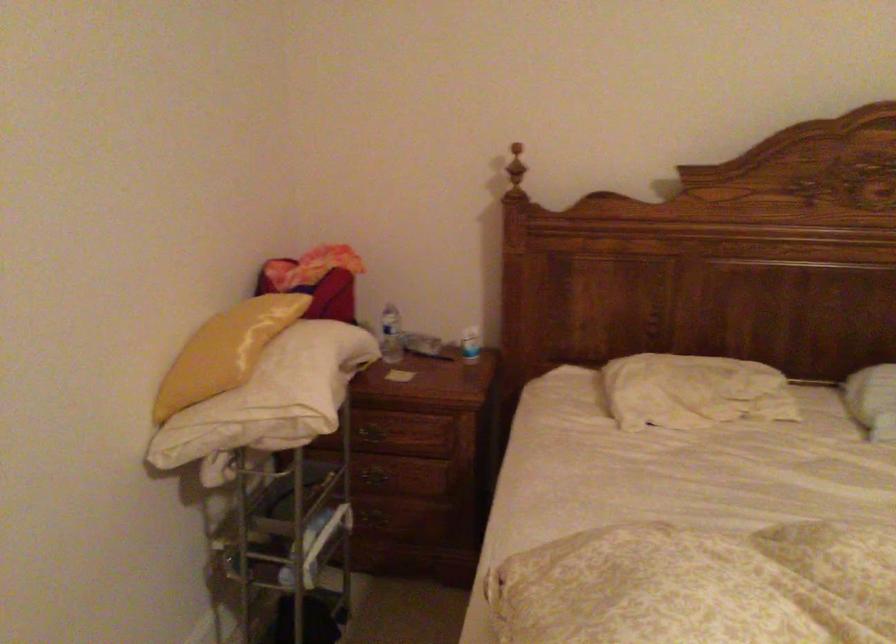
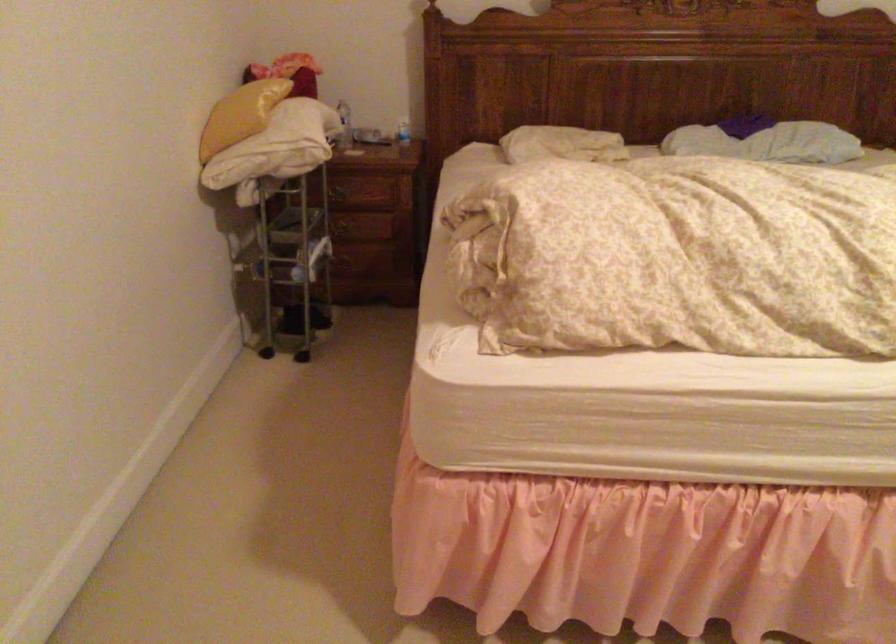
Question: I am providing you with two images of the same scene from different viewpoints. After the viewpoint changes to image2, which objects are now occluded?

Choices:
 (A) white pillow
 (B) drawer handle
 (C) yellow pillow
 (D) none of these

Answer: (D)